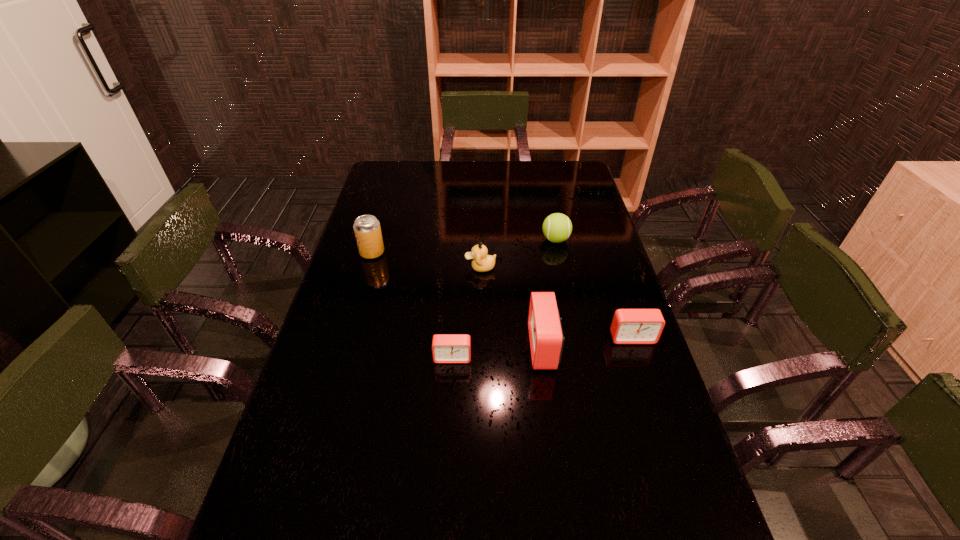
Find the location of `vacant space that satisfies the following two spatial constraints: 1. on the front-facing side of the second alarm clock from right to left; 2. on the front-facing side of the leftmost alarm clock`. vacant space that satisfies the following two spatial constraints: 1. on the front-facing side of the second alarm clock from right to left; 2. on the front-facing side of the leftmost alarm clock is located at coordinates (545, 357).

The image size is (960, 540). Find the location of `free spot that satisfies the following two spatial constraints: 1. on the front-facing side of the second alarm clock from right to left; 2. on the front-facing side of the shortest alarm clock`. free spot that satisfies the following two spatial constraints: 1. on the front-facing side of the second alarm clock from right to left; 2. on the front-facing side of the shortest alarm clock is located at coordinates (545, 357).